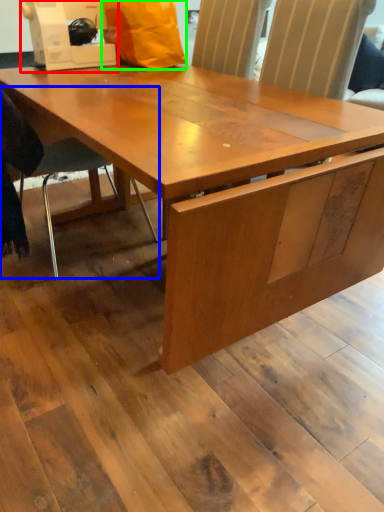
Question: Which object is the farthest from sewing machine (highlighted by a red box)? Choose among these: chair (highlighted by a blue box) or paper bag (highlighted by a green box).

Choices:
 (A) chair
 (B) paper bag

Answer: (A)